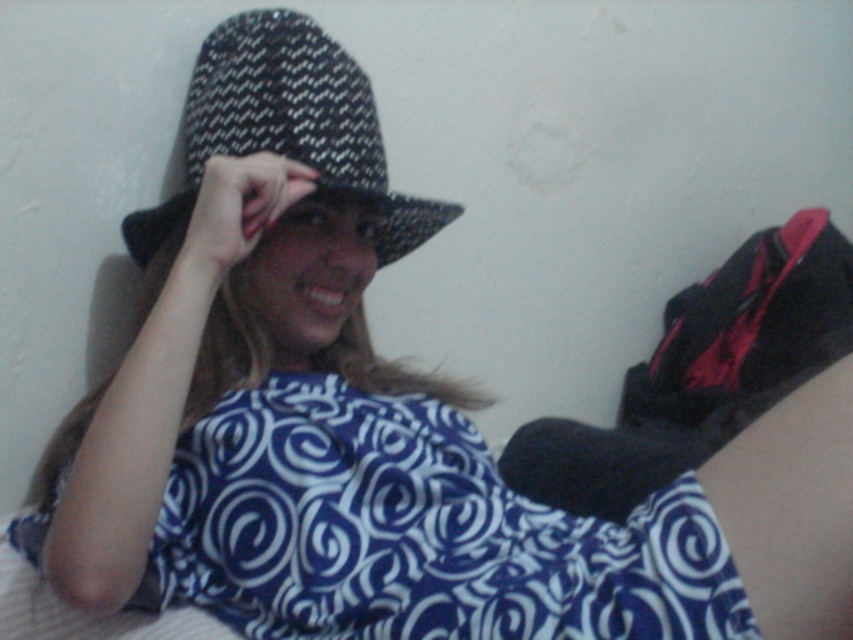
You are an interior designer planning to place a new lamp next to the blue printed fabric dress at center. According to the coordinates provided, where should the lamp be positioned relative to the dress?

The blue printed fabric dress at center is located at point 0.834 on the x and 0.485 on the y axis. To place the lamp next to it, position it near those coordinates for optimal placement.

You are a fashion designer who wants to create a new outfit using the blue printed fabric dress at center and the black woven fedora at upper center. Which item would you choose if you need a larger piece of fabric for your design?

The blue printed fabric dress at center has a larger width than the black woven fedora at upper center, so you should choose the blue printed fabric dress at center for a larger piece of fabric.